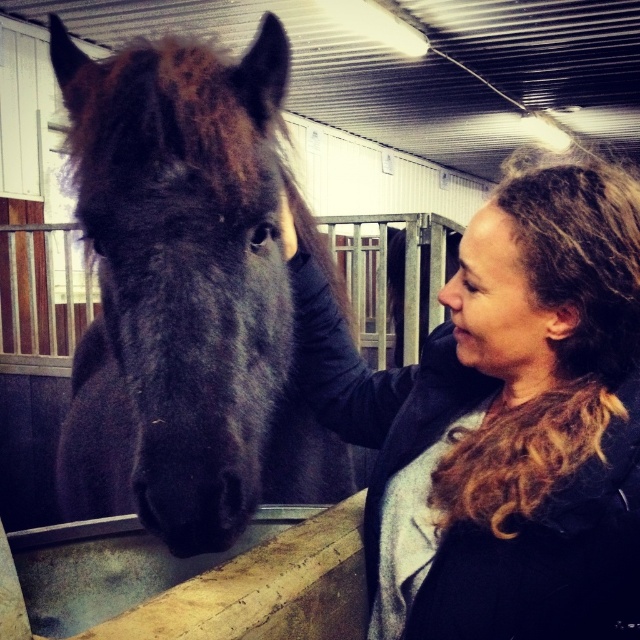
Does dark brown fuzzy horse at center appear over matte black nose at center?

Incorrect, dark brown fuzzy horse at center is not positioned above matte black nose at center.

Between dark brown fuzzy horse at center and matte black nose at center, which one is positioned higher?

matte black nose at center is above.

The image size is (640, 640). Describe the element at coordinates (189, 294) in the screenshot. I see `dark brown fuzzy horse at center` at that location.

In order to click on dark brown fuzzy horse at center in this screenshot , I will do [x=189, y=294].

Looking at this image, does curly hair at upper right have a greater width compared to matte black nose at center?

Yes, curly hair at upper right is wider than matte black nose at center.

Does point (625, 250) come in front of point (442, 296)?

Yes, it is in front of point (442, 296).

Locate an element on the screen. Image resolution: width=640 pixels, height=640 pixels. curly hair at upper right is located at coordinates click(525, 384).

Can you confirm if dark brown fuzzy horse at center is thinner than curly hair at upper right?

No, dark brown fuzzy horse at center is not thinner than curly hair at upper right.

Who is positioned more to the left, dark brown fuzzy horse at center or curly hair at upper right?

Positioned to the left is dark brown fuzzy horse at center.

This screenshot has width=640, height=640. Identify the location of dark brown fuzzy horse at center. (189, 294).

The width and height of the screenshot is (640, 640). Identify the location of dark brown fuzzy horse at center. (189, 294).